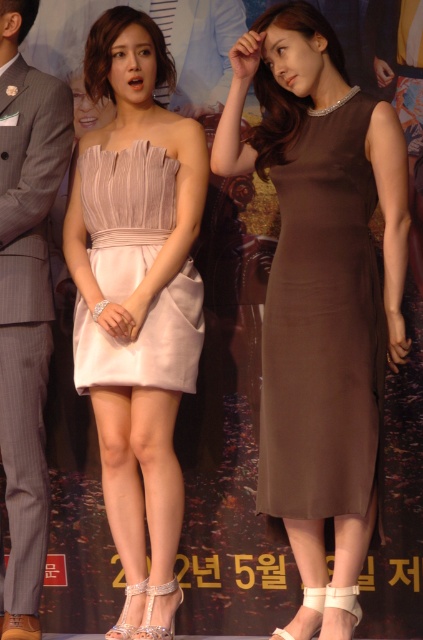
Can you confirm if gray pinstripe suit at left is shorter than pale pink satin dress at center?

In fact, gray pinstripe suit at left may be taller than pale pink satin dress at center.

Between gray pinstripe suit at left and pale pink satin dress at center, which one has less height?

pale pink satin dress at center

Between point (38, 504) and point (172, 308), which one is positioned in front?

Point (172, 308) is in front.

At what (x,y) coordinates should I click in order to perform the action: click on gray pinstripe suit at left. Please return your answer as a coordinate pair (x, y). Looking at the image, I should click on (27, 310).

Between matte pink dress at center and gray pinstripe suit at left, which one is positioned lower?

gray pinstripe suit at left

Which of these two, matte pink dress at center or gray pinstripe suit at left, stands shorter?

gray pinstripe suit at left is shorter.

Is point (150, 401) behind point (32, 230)?

No, (150, 401) is in front of (32, 230).

Identify the location of matte pink dress at center. The image size is (423, 640). (137, 301).

Is matte brown dress at center above gray pinstripe suit at left?

Yes, matte brown dress at center is above gray pinstripe suit at left.

Which is below, matte brown dress at center or gray pinstripe suit at left?

Positioned lower is gray pinstripe suit at left.

Find the location of `matte brown dress at center`. matte brown dress at center is located at coordinates (321, 292).